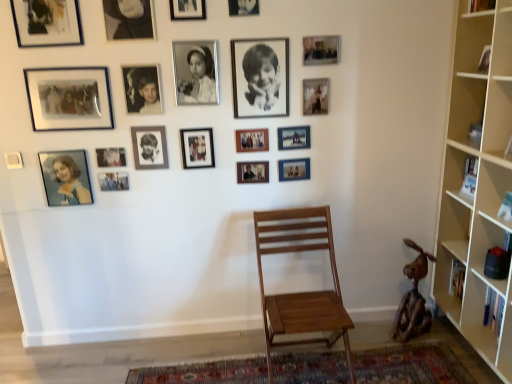
This screenshot has width=512, height=384. I want to click on free region under rustic wood sculpture at lower right (from a real-world perspective), so click(411, 337).